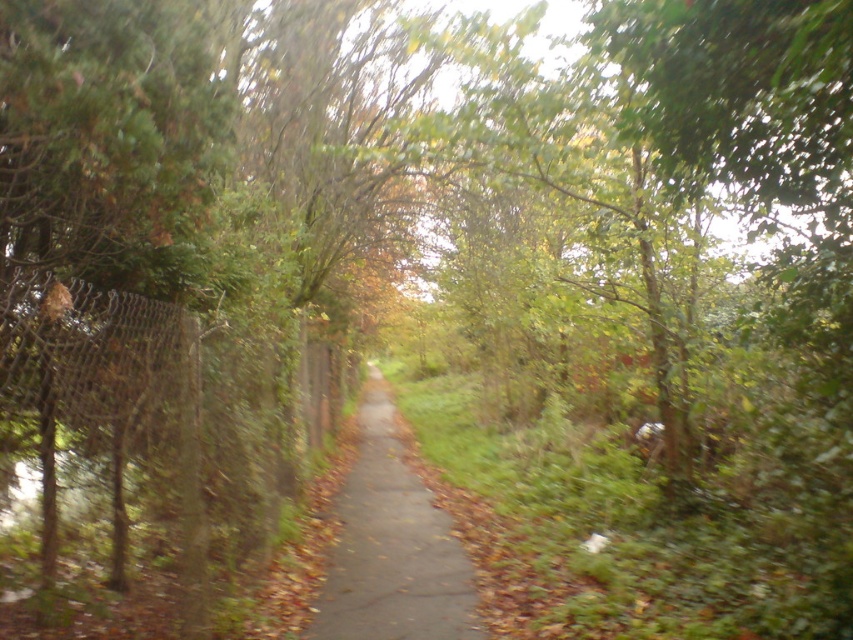
Describe the element at coordinates (148, 454) in the screenshot. I see `rusty chain-link fence at left` at that location.

Does rusty chain-link fence at left have a smaller size compared to gray concrete pavement at center?

Incorrect, rusty chain-link fence at left is not smaller in size than gray concrete pavement at center.

Find the location of a particular element. Image resolution: width=853 pixels, height=640 pixels. rusty chain-link fence at left is located at coordinates (148, 454).